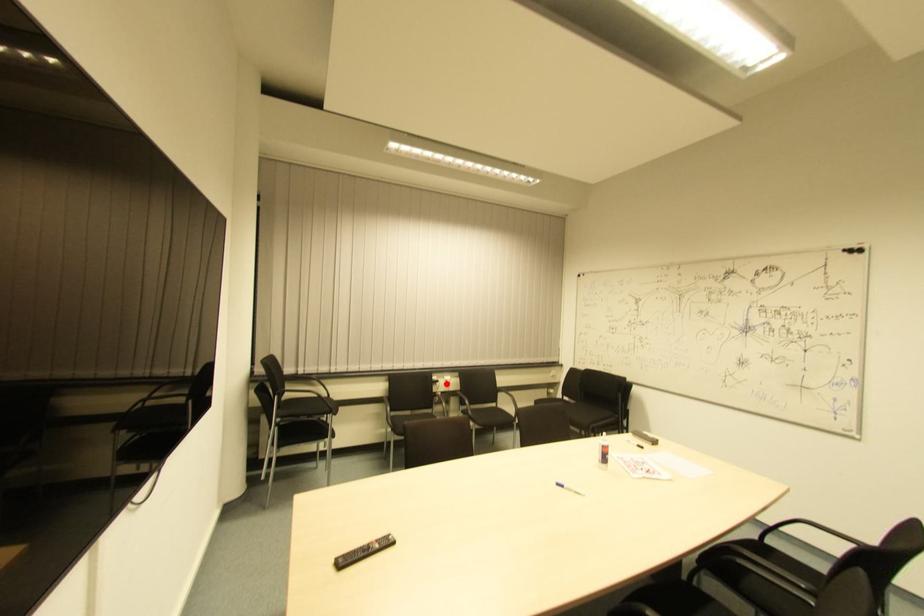
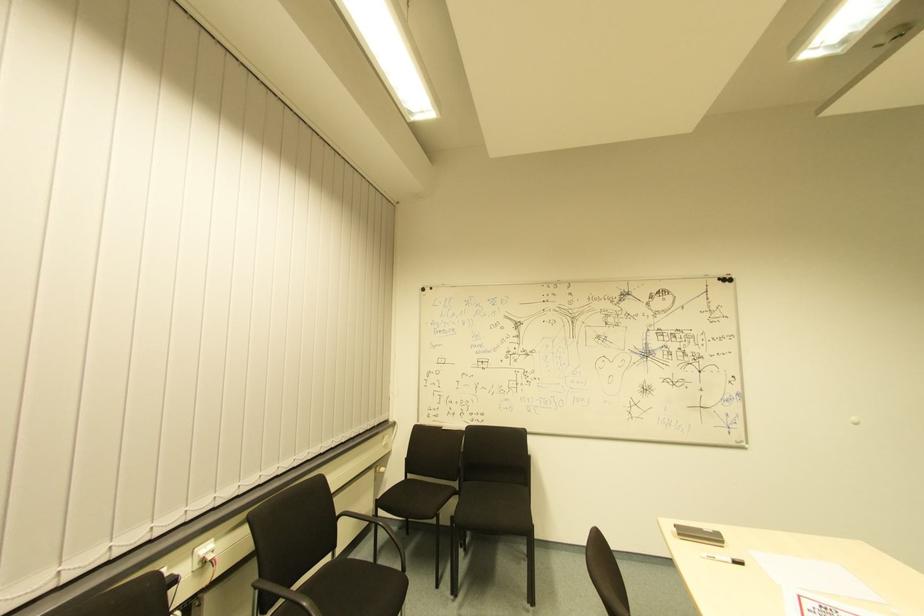
The point at the highlighted location is marked in the first image. Where is the corresponding point in the second image?

(208, 561)